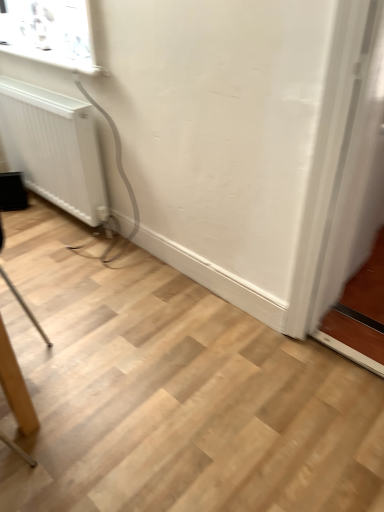
Image resolution: width=384 pixels, height=512 pixels. Find the location of `empty space that is ontop of white matte radiator at left (from a real-world perspective)`. empty space that is ontop of white matte radiator at left (from a real-world perspective) is located at coordinates (40, 87).